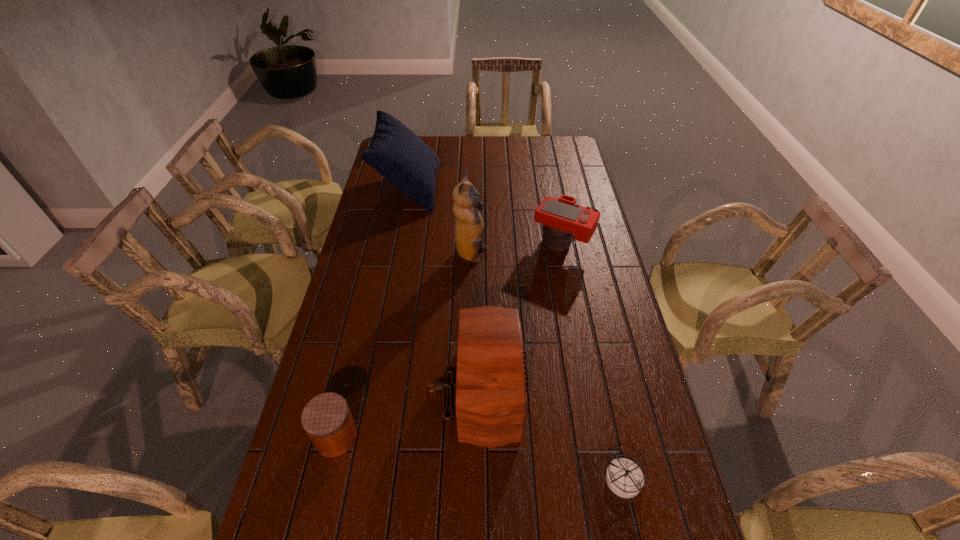
Where is `vacant position located on the front-facing side of the third tallest object`? The width and height of the screenshot is (960, 540). vacant position located on the front-facing side of the third tallest object is located at coordinates (572, 390).

Where is `vacant space located on the back of the fourth tallest object`? vacant space located on the back of the fourth tallest object is located at coordinates (550, 182).

Where is `free space located 0.400m on the right of the second shortest object`? This screenshot has height=540, width=960. free space located 0.400m on the right of the second shortest object is located at coordinates (514, 437).

Identify the location of vacant position located 0.060m on the left of the nearest object. (580, 479).

You are a GUI agent. You are given a task and a screenshot of the screen. Output one action in this format:
    pyautogui.click(x=<x>, y=<y>)
    Task: Click on the cushion that is positioned at the left edge
    The image size is (960, 540).
    Given the screenshot: What is the action you would take?
    tap(395, 152)

This screenshot has width=960, height=540. Identify the location of jar positioned at the left edge. (326, 418).

Locate an element on the screen. The width and height of the screenshot is (960, 540). camera that is at the right edge is located at coordinates (562, 217).

Where is `compass that is positioned at the right edge`? This screenshot has width=960, height=540. compass that is positioned at the right edge is located at coordinates (624, 477).

Locate an element on the screen. vacant space at the far edge of the desktop is located at coordinates (527, 143).

In the image, there is a desktop. Identify the location of vacant space at the left edge. The width and height of the screenshot is (960, 540). (382, 239).